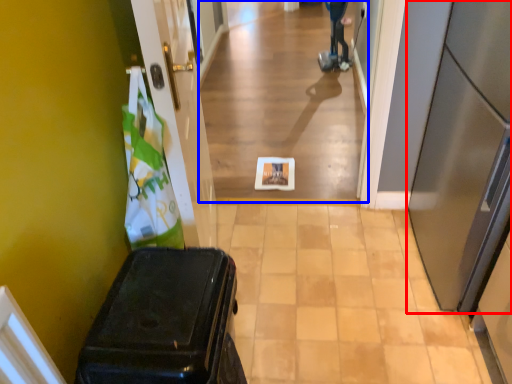
Question: Which point is further to the camera, door (highlighted by a red box) or corridor (highlighted by a blue box)?

Choices:
 (A) door
 (B) corridor

Answer: (B)